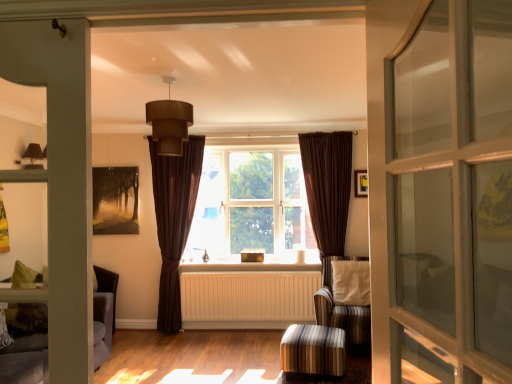
Question: From a real-world perspective, relative to clear glass screen door at right, is brown velvet curtain at center, marked as the second curtain in a left-to-right arrangement, vertically above or below?

Choices:
 (A) below
 (B) above

Answer: (A)

Question: Is brown velvet curtain at center, the 1th curtain viewed from the right, wider or thinner than clear glass screen door at right?

Choices:
 (A) wide
 (B) thin

Answer: (A)

Question: Which object is the closest to the clear glass screen door at right?

Choices:
 (A) striped fabric armchair at center
 (B) velvet grey couch at left
 (C) striped fabric stool at lower center
 (D) wooden picture frame at upper center
 (E) matte brown lampshade at upper center

Answer: (E)

Question: Which object is the farthest from the brown velvet curtain at center, positioned as the first curtain in left-to-right order?

Choices:
 (A) clear glass screen door at right
 (B) wooden picture frame at upper center
 (C) matte brown lampshade at upper center
 (D) striped fabric stool at lower center
 (E) white painted wood at center

Answer: (A)